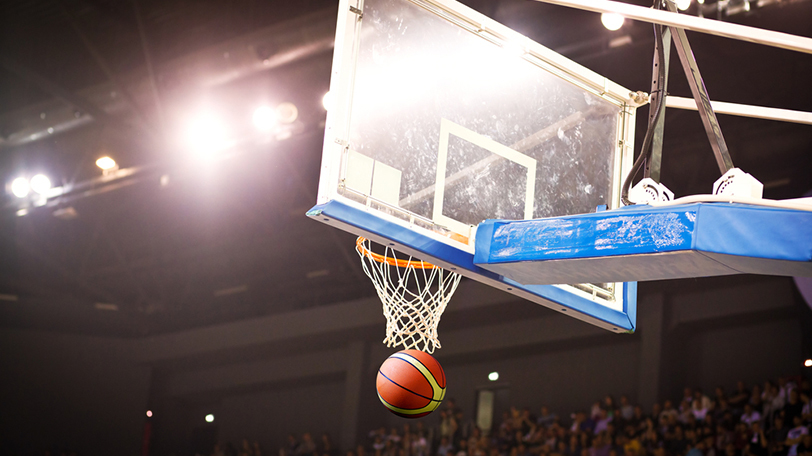
I want to click on lights, so click(19, 184), click(40, 180), click(106, 165), click(266, 123), click(287, 115), click(195, 139), click(213, 139), click(326, 100), click(611, 19), click(679, 5).